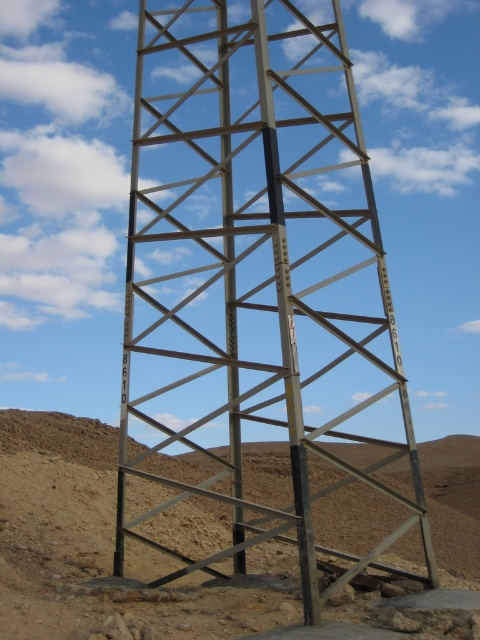
You are navigating a desert terrain and need to locate a specific coordinate point. According to the image, where exactly is the metallic structure at center positioned?

The metallic structure at center is positioned at point (250, 257).

You are an engineer inspecting a desert site. You see the metallic structure at center and the brown sandy soil at center. Which object is located more to the left?

The metallic structure at center is positioned on the left side of brown sandy soil at center, so it is more to the left.

You are standing at the point with coordinates (250,257) in a desert environment. What object are you directly facing?

You are directly facing the metallic structure at center, as the point coordinates (250,257) corresponds to it.